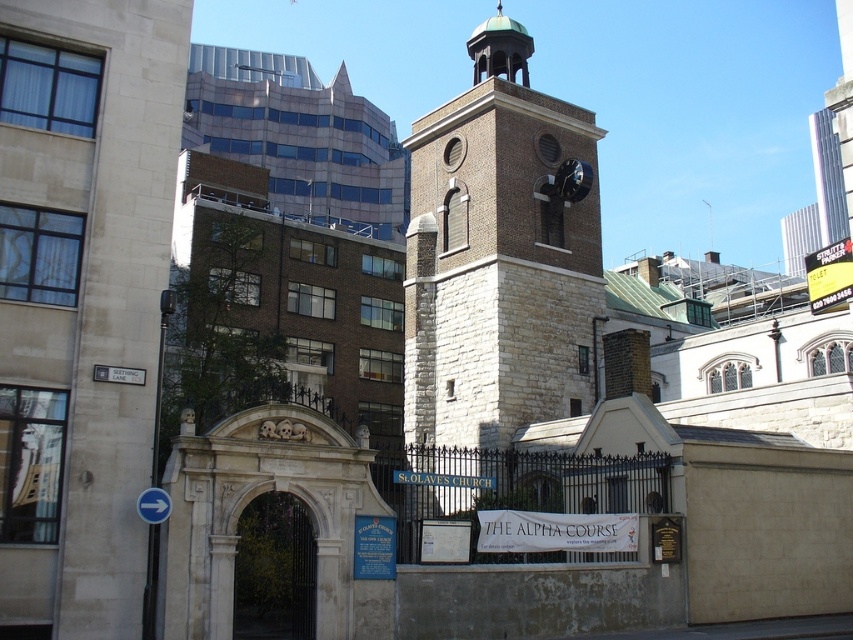
Is point (508, 195) positioned after point (523, 84)?

No, it is not.

Does point (527, 321) lie in front of point (482, 22)?

Yes, point (527, 321) is closer to viewer.

I want to click on stone clock tower at center, so click(x=498, y=257).

Measure the distance between green copper bell tower at center and camera.

green copper bell tower at center and camera are 238.93 feet apart from each other.

Which is above, green copper bell tower at center or polished brass clock at upper center?

green copper bell tower at center is higher up.

Which is behind, point (494, 20) or point (572, 188)?

The point (494, 20) is behind.

The image size is (853, 640). In order to click on green copper bell tower at center in this screenshot , I will do `click(498, 49)`.

Does stone clock tower at center have a lesser height compared to polished brass clock at upper center?

No.

Does point (483, 244) come closer to viewer compared to point (563, 198)?

Yes, point (483, 244) is closer to viewer.

Image resolution: width=853 pixels, height=640 pixels. I want to click on stone clock tower at center, so click(x=498, y=257).